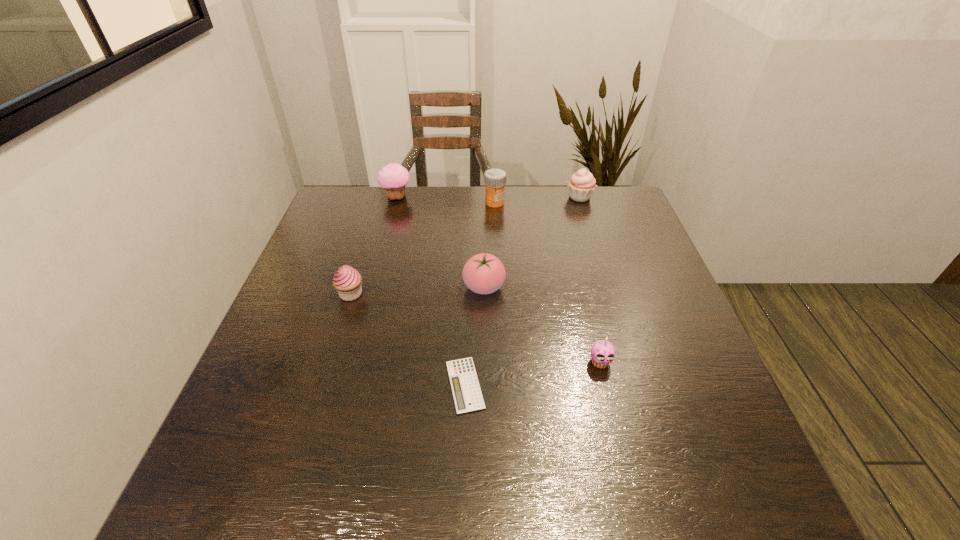
Find the location of a particular element. object that can be found as the second closest to the shortest object is located at coordinates (602, 352).

Where is `the third closest cupcake to the shortest cupcake`? The width and height of the screenshot is (960, 540). the third closest cupcake to the shortest cupcake is located at coordinates (393, 178).

Select which cupcake is the fourth closest to the tomato. Please provide its 2D coordinates. Your answer should be formatted as a tuple, i.e. [(x, y)], where the tuple contains the x and y coordinates of a point satisfying the conditions above.

[(581, 185)]